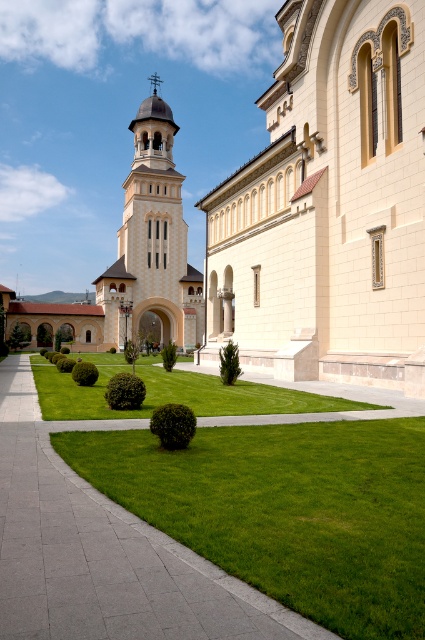
You are standing at the entrance of the building and see two points marked on the walkway. Which point is closer to you, point (129, 292) or point (203, 396)?

Point (203, 396) is closer to you because point (129, 292) is further away from the camera.

You are standing at the entrance of the cathedral and want to locate the beige stone tower at center. According to the coordinates provided, where should you look relative to your current position?

The beige stone tower at center is located at coordinates point [152,243]. Since coordinates in images typically start from the bottom left corner, the tower is positioned 38.0 percent from the left edge and 35.8 percent from the bottom edge of the image. This places it slightly to the right and above the center point of the image.

You are standing at the point marked by the coordinate point at (295, 212) in the image. What architectural structure are you facing?

The point at (295, 212) marks the beige stone church at center, so you are facing the beige stone church at center.